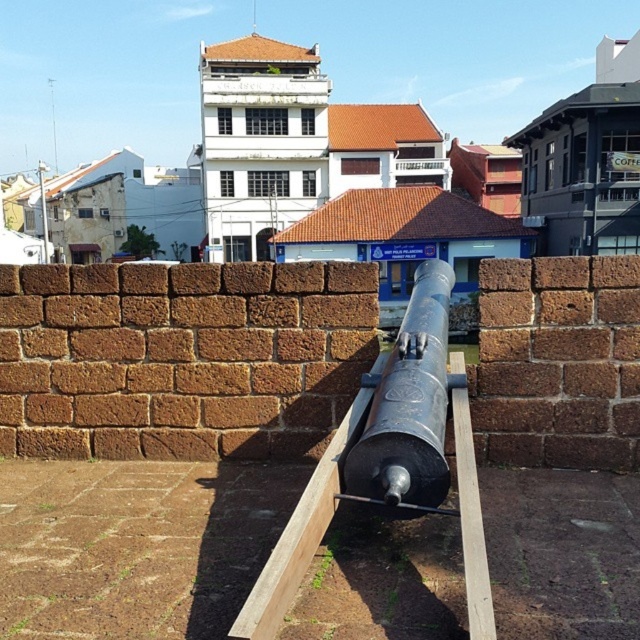
This screenshot has height=640, width=640. What do you see at coordinates (388, 461) in the screenshot? I see `black metal cannon at center` at bounding box center [388, 461].

Is point (481, 557) positioned behind point (428, 358)?

No, (481, 557) is in front of (428, 358).

Measure the distance between black metal cannon at center and camera.

A distance of 3.02 meters exists between black metal cannon at center and camera.

This screenshot has height=640, width=640. Find the location of `black metal cannon at center`. black metal cannon at center is located at coordinates (388, 461).